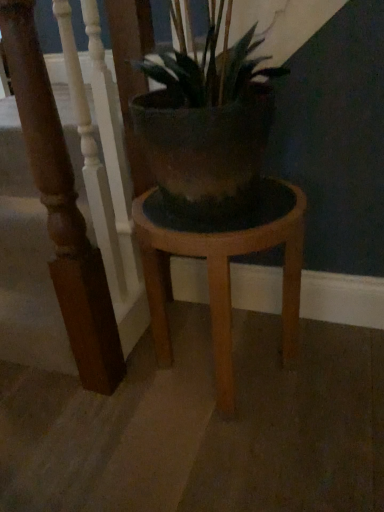
The height and width of the screenshot is (512, 384). Describe the element at coordinates (62, 209) in the screenshot. I see `wooden stair rail at left` at that location.

Identify the location of wooden stair rail at left. The height and width of the screenshot is (512, 384). (62, 209).

Measure the distance between wooden stair rail at left and camera.

The depth of wooden stair rail at left is 28.70 inches.

This screenshot has height=512, width=384. Describe the element at coordinates (221, 268) in the screenshot. I see `wooden stool at center` at that location.

Find the location of a particular element. This screenshot has width=384, height=512. wooden stool at center is located at coordinates (221, 268).

Image resolution: width=384 pixels, height=512 pixels. In order to click on wooden stair rail at left in this screenshot , I will do `click(62, 209)`.

Which is more to the right, wooden stair rail at left or wooden stool at center?

wooden stool at center is more to the right.

Based on the photo, which object is more forward, wooden stair rail at left or wooden stool at center?

wooden stair rail at left is more forward.

Which is less distant, (81, 350) or (163, 245)?

Point (81, 350) is positioned farther from the camera compared to point (163, 245).

From the image's perspective, which is below, wooden stair rail at left or wooden stool at center?

From the image's view, wooden stool at center is below.

Looking at this image, from a real-world perspective, does wooden stair rail at left sit lower than wooden stool at center?

Incorrect, from a real-world perspective, wooden stair rail at left is higher than wooden stool at center.

Which of these two, wooden stair rail at left or wooden stool at center, is thinner?

Thinner between the two is wooden stair rail at left.

Consider the image. Between wooden stair rail at left and wooden stool at center, which one has more height?

Standing taller between the two is wooden stair rail at left.

Looking at the image, does wooden stair rail at left seem bigger or smaller compared to wooden stool at center?

wooden stair rail at left is smaller than wooden stool at center.

Would you say wooden stair rail at left is inside or outside wooden stool at center?

wooden stair rail at left is not enclosed by wooden stool at center.

Are wooden stair rail at left and wooden stool at center located far from each other?

They are positioned close to each other.

Is wooden stair rail at left aimed at wooden stool at center?

Yes.

What's the angular difference between wooden stair rail at left and wooden stool at center's facing directions?

90.8 degrees.

Measure the distance between wooden stair rail at left and wooden stool at center.

The distance of wooden stair rail at left from wooden stool at center is 26.94 centimeters.

Locate an element on the screen. This screenshot has height=512, width=384. stool on the right of the wooden stair rail at left is located at coordinates (221, 268).

Which is more to the right, wooden stool at center or wooden stair rail at left?

From the viewer's perspective, wooden stool at center appears more on the right side.

In the image, is wooden stool at center positioned in front of or behind wooden stair rail at left?

Clearly, wooden stool at center is behind wooden stair rail at left.

Considering the positions of point (297, 203) and point (20, 45), is point (297, 203) closer or farther from the camera than point (20, 45)?

Point (297, 203) is positioned farther from the camera compared to point (20, 45).

From the image's perspective, is wooden stool at center below wooden stair rail at left?

Correct, wooden stool at center appears lower than wooden stair rail at left in the image.

From a real-world perspective, which is physically below, wooden stool at center or wooden stair rail at left?

From a 3D spatial view, wooden stool at center is below.

Considering the relative sizes of wooden stool at center and wooden stair rail at left in the image provided, is wooden stool at center thinner than wooden stair rail at left?

Incorrect, the width of wooden stool at center is not less than that of wooden stair rail at left.

Which of these two, wooden stool at center or wooden stair rail at left, stands shorter?

wooden stool at center.

Is wooden stool at center bigger than wooden stair rail at left?

Correct, wooden stool at center is larger in size than wooden stair rail at left.

Is wooden stair rail at left located within wooden stool at center?

No.

Can you see wooden stool at center touching wooden stair rail at left?

No, wooden stool at center is not making contact with wooden stair rail at left.

Is wooden stool at center looking in the opposite direction of wooden stair rail at left?

No, wooden stool at center is not facing away from wooden stair rail at left.

How many degrees apart are the facing directions of wooden stool at center and wooden stair rail at left?

There is a 90.8-degree angle between the facing directions of wooden stool at center and wooden stair rail at left.

Identify the location of stool on the right of wooden stair rail at left. The height and width of the screenshot is (512, 384). (221, 268).

This screenshot has width=384, height=512. Find the location of `rail on the left of wooden stool at center`. rail on the left of wooden stool at center is located at coordinates (62, 209).

Where is `stool located on the right of wooden stair rail at left`? stool located on the right of wooden stair rail at left is located at coordinates (221, 268).